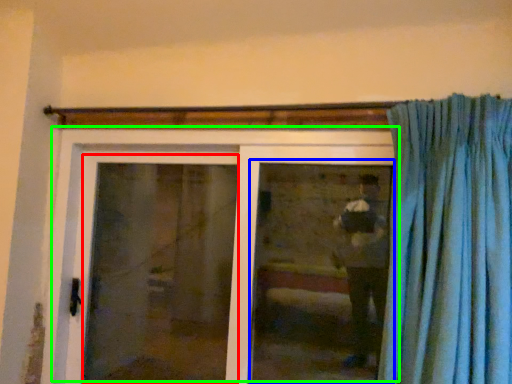
Question: Considering the real-world distances, which object is farthest from screen door (highlighted by a red box)? window (highlighted by a blue box) or door (highlighted by a green box)?

Choices:
 (A) window
 (B) door

Answer: (A)